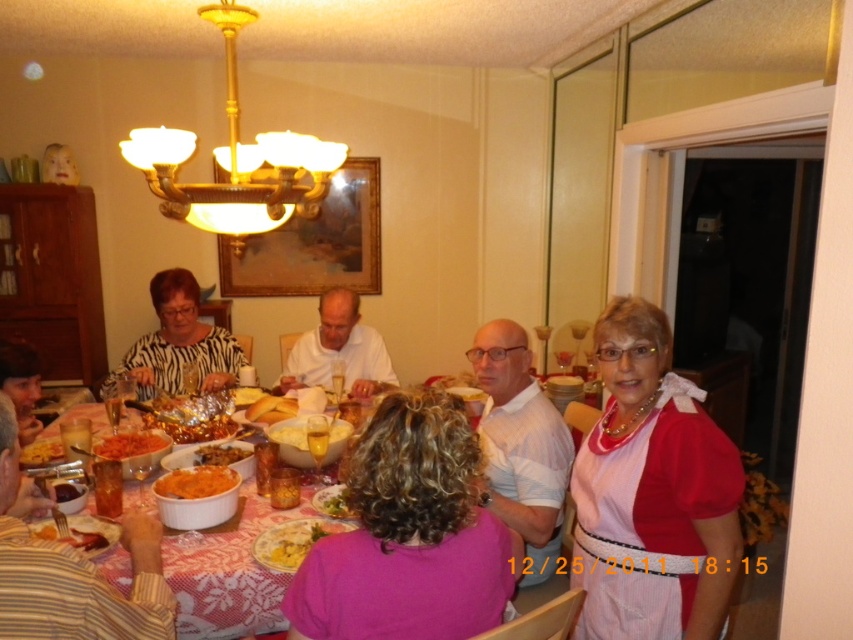
Question: Is pink satin blouse at right further to camera compared to white creamy bowl at center?

Choices:
 (A) no
 (B) yes

Answer: (A)

Question: Among these points, which one is nearest to the camera?

Choices:
 (A) (213, 424)
 (B) (328, 369)
 (C) (149, 556)

Answer: (C)

Question: In this image, where is striped fabric shirt at lower left located relative to white creamy bowl at center?

Choices:
 (A) above
 (B) below

Answer: (B)

Question: Which object is positioned farthest from the shiny orange sauce at table center?

Choices:
 (A) yellowish matte pasta at lower left
 (B) green leafy vegetable at center

Answer: (B)

Question: Does matte black hair at lower left have a lesser width compared to green leafy vegetable at center?

Choices:
 (A) no
 (B) yes

Answer: (B)

Question: Which object is closer to the camera taking this photo?

Choices:
 (A) golden crispy pastry at center
 (B) yellow matte pasta at center
 (C) shiny orange sauce at table center
 (D) white creamy bowl at center

Answer: (B)